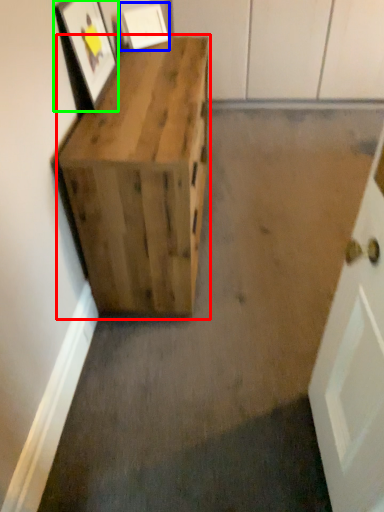
Question: Estimate the real-world distances between objects in this image. Which object is farther from furniture (highlighted by a red box), picture frame (highlighted by a blue box) or picture frame (highlighted by a green box)?

Choices:
 (A) picture frame
 (B) picture frame

Answer: (A)